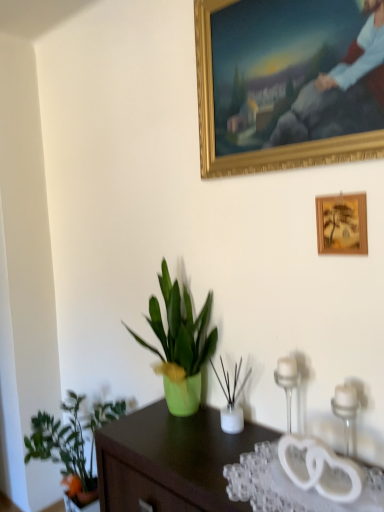
Question: Does clear glass candle holder at right, the second candle holder viewed from the front, have a larger size compared to green matte plant at lower left, the third houseplant viewed from the right?

Choices:
 (A) yes
 (B) no

Answer: (B)

Question: Can we say clear glass candle holder at right, the second candle holder viewed from the front, lies outside green matte plant at lower left, which is the 3th houseplant in top-to-bottom order?

Choices:
 (A) no
 (B) yes

Answer: (B)

Question: Does clear glass candle holder at right, positioned as the first candle holder in back-to-front order, touch green matte plant at lower left, which is the 3th houseplant in top-to-bottom order?

Choices:
 (A) no
 (B) yes

Answer: (A)

Question: Is clear glass candle holder at right, the second candle holder viewed from the front, positioned behind green matte plant at lower left, placed as the 1th houseplant when sorted from left to right?

Choices:
 (A) yes
 (B) no

Answer: (B)

Question: From the image's perspective, is clear glass candle holder at right, positioned as the first candle holder in back-to-front order, located beneath green matte plant at lower left, placed as the 1th houseplant when sorted from left to right?

Choices:
 (A) yes
 (B) no

Answer: (B)

Question: From the image's perspective, is clear glass candle holder at right, marked as the 2th candle holder in a right-to-left arrangement, located above or below wooden picture frame at lower right, placed as the first picture frame when sorted from bottom to top?

Choices:
 (A) above
 (B) below

Answer: (B)

Question: Is clear glass candle holder at right, marked as the 2th candle holder in a right-to-left arrangement, wider or thinner than wooden picture frame at lower right, which is counted as the 2th picture frame, starting from the top?

Choices:
 (A) wide
 (B) thin

Answer: (A)

Question: Is clear glass candle holder at right, marked as the 2th candle holder in a right-to-left arrangement, in front of or behind wooden picture frame at lower right, which is counted as the 2th picture frame, starting from the top, in the image?

Choices:
 (A) behind
 (B) front

Answer: (A)

Question: Considering the positions of clear glass candle holder at right, positioned as the first candle holder in back-to-front order, and wooden picture frame at lower right, placed as the first picture frame when sorted from bottom to top, in the image, is clear glass candle holder at right, positioned as the first candle holder in back-to-front order, taller or shorter than wooden picture frame at lower right, placed as the first picture frame when sorted from bottom to top,?

Choices:
 (A) tall
 (B) short

Answer: (A)

Question: Is transparent plastic glass table at lower right in front of or behind green matte vase at center, arranged as the 2th houseplant when viewed from the top, in the image?

Choices:
 (A) behind
 (B) front

Answer: (B)

Question: From the image's perspective, is transparent plastic glass table at lower right positioned above or below green matte vase at center, placed as the first houseplant when sorted from right to left?

Choices:
 (A) below
 (B) above

Answer: (A)

Question: In terms of height, does transparent plastic glass table at lower right look taller or shorter compared to green matte vase at center, which appears as the 2th houseplant when ordered from the bottom?

Choices:
 (A) tall
 (B) short

Answer: (B)

Question: Is transparent plastic glass table at lower right bigger or smaller than green matte vase at center, arranged as the 2th houseplant when viewed from the top?

Choices:
 (A) small
 (B) big

Answer: (A)

Question: Which is correct: green matte plant at lower left, acting as the first houseplant starting from the bottom, is inside green matte plant at center, marked as the first houseplant in a top-to-bottom arrangement, or outside of it?

Choices:
 (A) outside
 (B) inside

Answer: (A)

Question: In terms of width, does green matte plant at lower left, acting as the first houseplant starting from the bottom, look wider or thinner when compared to green matte plant at center, marked as the 2th houseplant in a right-to-left arrangement?

Choices:
 (A) wide
 (B) thin

Answer: (A)